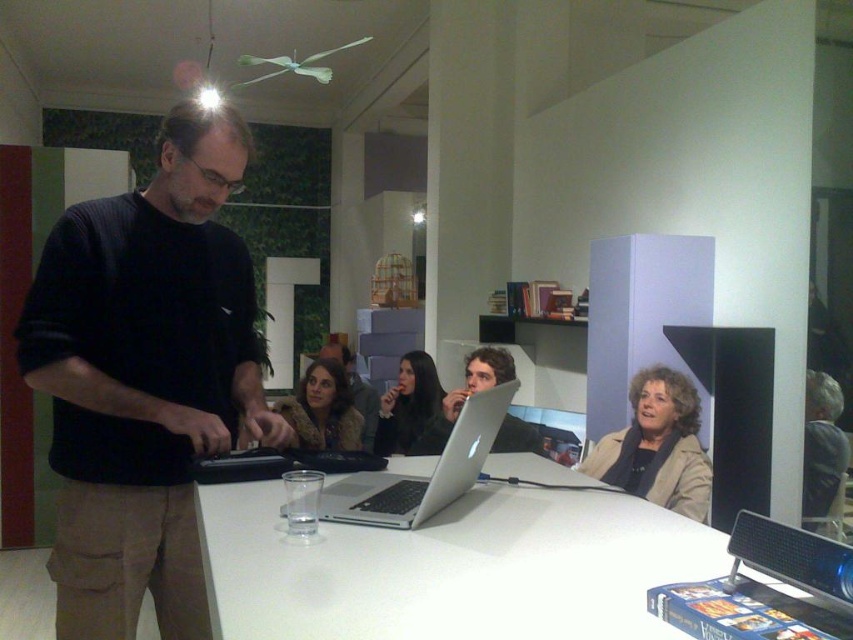
Where is `gray fabric jacket at lower right`? gray fabric jacket at lower right is located at coordinates (822, 445).

The width and height of the screenshot is (853, 640). Describe the element at coordinates (822, 445) in the screenshot. I see `gray fabric jacket at lower right` at that location.

Describe the element at coordinates (822, 445) in the screenshot. I see `gray fabric jacket at lower right` at that location.

Image resolution: width=853 pixels, height=640 pixels. In order to click on gray fabric jacket at lower right in this screenshot , I will do `click(822, 445)`.

Can you confirm if black matte shirt at center is shorter than silver metallic laptop at center?

In fact, black matte shirt at center may be taller than silver metallic laptop at center.

Who is positioned more to the right, black matte shirt at center or silver metallic laptop at center?

Positioned to the right is silver metallic laptop at center.

Is point (86, 435) more distant than point (370, 500)?

Yes, point (86, 435) is farther from viewer.

You are a GUI agent. You are given a task and a screenshot of the screen. Output one action in this format:
    pyautogui.click(x=<x>, y=<y>)
    Task: Click on the black matte shirt at center
    The image size is (853, 640).
    Given the screenshot: What is the action you would take?
    pyautogui.click(x=144, y=378)

Who is taller, white glossy table at center or brown textured jacket at center?

Standing taller between the two is brown textured jacket at center.

Which is more to the right, white glossy table at center or brown textured jacket at center?

From the viewer's perspective, white glossy table at center appears more on the right side.

What are the coordinates of `white glossy table at center` in the screenshot? It's located at (451, 566).